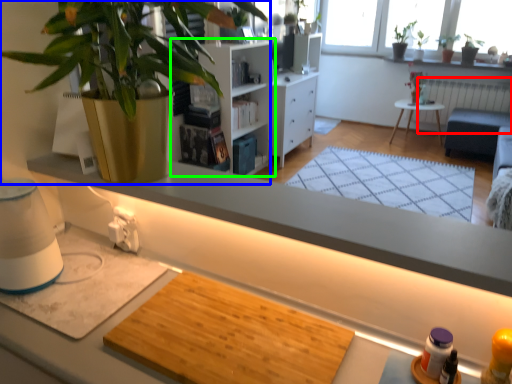
Question: Considering the real-world distances, which object is farthest from radiator (highlighted by a red box)? houseplant (highlighted by a blue box) or shelf (highlighted by a green box)?

Choices:
 (A) houseplant
 (B) shelf

Answer: (A)